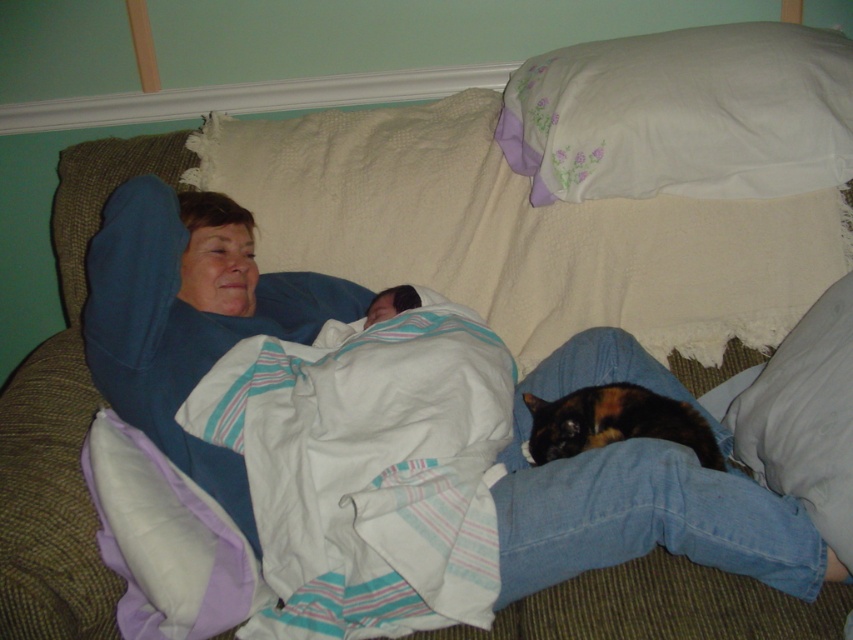
You are a photographer trying to capture the calico fur cat at lower right and the white soft pillow at lower right in a single shot. Which object should you position closer to the left side of the frame to ensure both are visible?

The calico fur cat at lower right should be positioned closer to the left side of the frame since the white soft pillow at lower right is to the right of it.

You are a home assistant and need to place a new decorative item between the white textured blanket at center and the white cotton pillow at upper right. Where should you place it?

The white textured blanket at center is below the white cotton pillow at upper right, so you should place the new decorative item between them either above the blanket or below the pillow, ensuring it fits in the space between these two items.

You are standing in the room and want to place a small vase on the white soft pillow at lower right. According to the coordinates provided, where exactly should you place the vase?

The white soft pillow at lower right is located at point (x=805, y=419), so you should place the vase there.